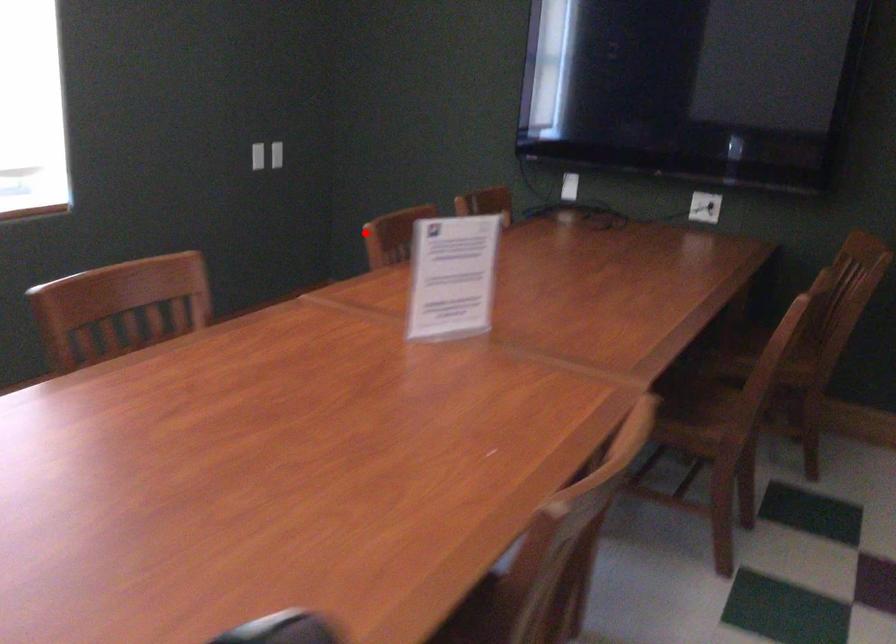
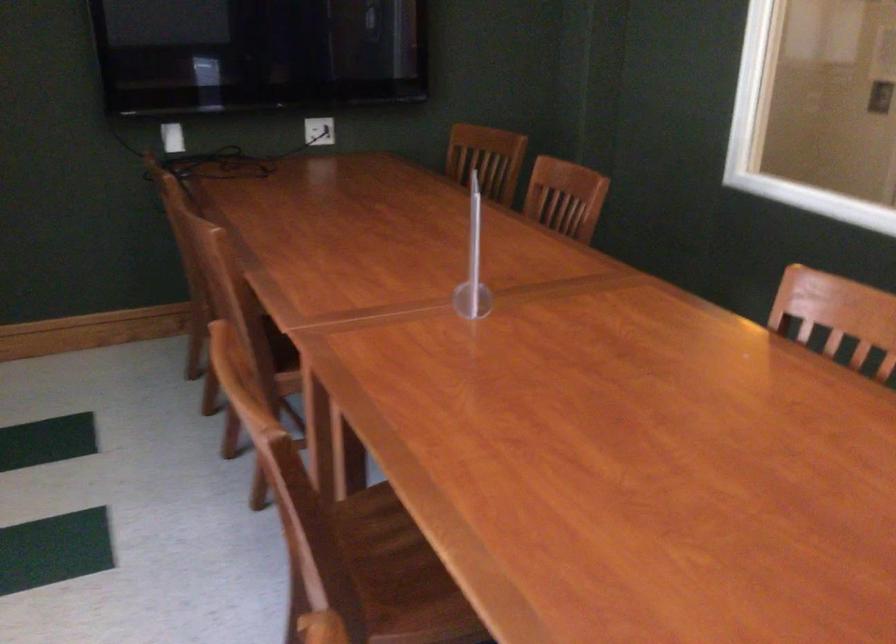
Question: I am providing you with two images of the same scene from different viewpoints. Image1 has a red point marked. In image2, the corresponding 3D location appears at what relative position? Reply with the corresponding letter.

Choices:
 (A) Closer
 (B) Farther

Answer: (A)